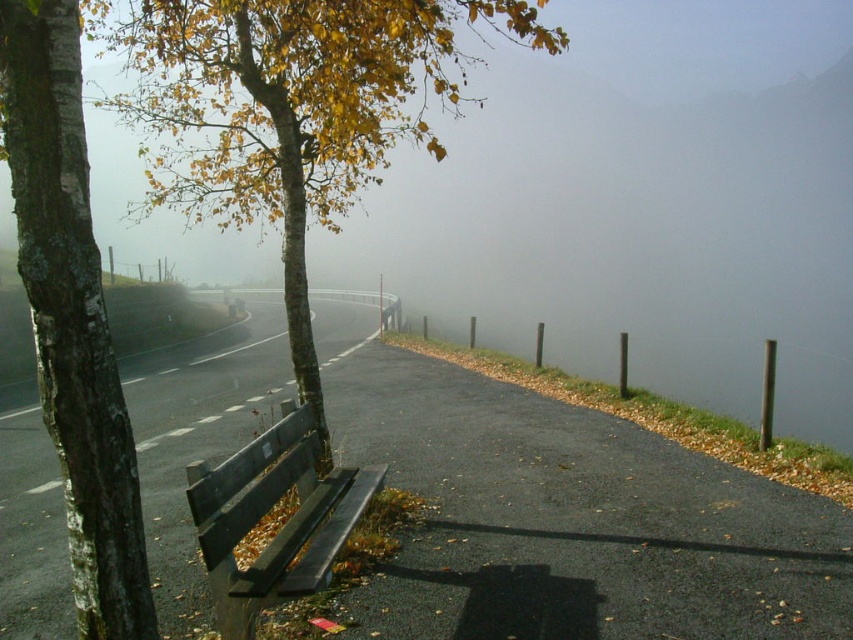
You are standing at the edge of the road in the scene and want to take a photo that includes both point (279, 176) and point (129, 451). Which point should you focus on to ensure both are in sharp focus?

You should focus on point (279, 176) because it is closer to the camera than point (129, 451). This ensures the depth of field will cover both points effectively.